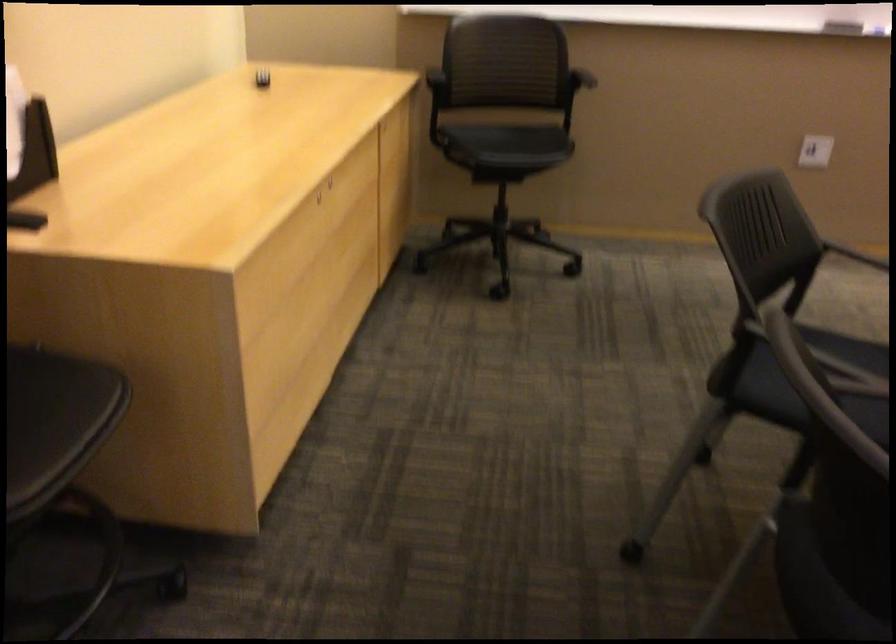
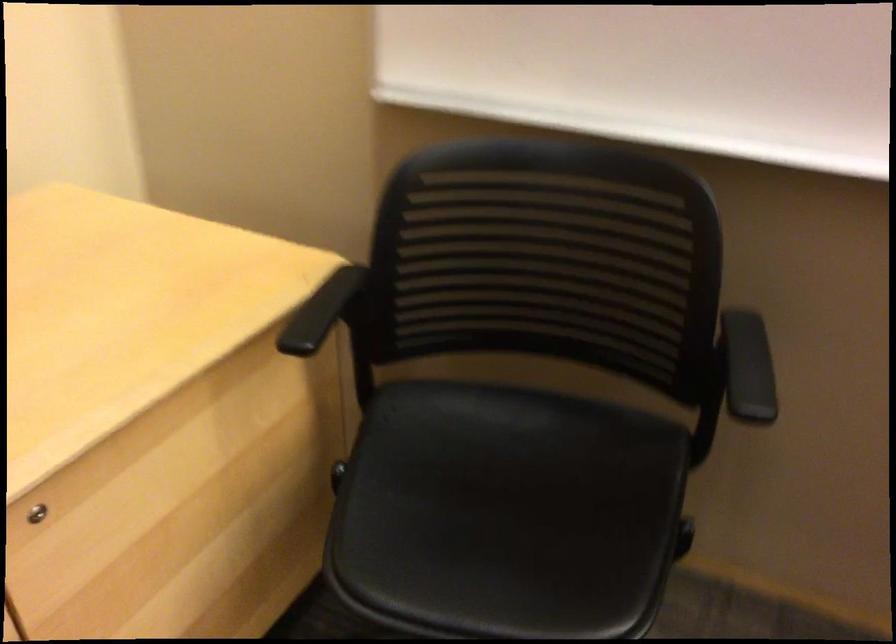
Locate, in the second image, the point that corresponds to (431,82) in the first image.

(322, 310)